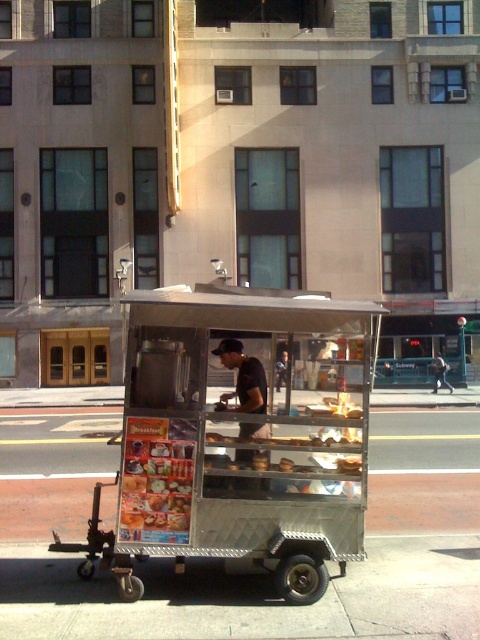
Does brushed metal pavement at lower center appear on the right side of metallic silver cart at center?

No, brushed metal pavement at lower center is not to the right of metallic silver cart at center.

Which of these two, brushed metal pavement at lower center or metallic silver cart at center, stands shorter?

brushed metal pavement at lower center is shorter.

At what (x,y) coordinates should I click in order to perform the action: click on brushed metal pavement at lower center. Please return your answer as a coordinate pair (x, y). Looking at the image, I should click on (251, 596).

In order to click on brushed metal pavement at lower center in this screenshot , I will do `click(251, 596)`.

Is brushed metal pavement at lower center taller than dark blue uniform at center?

Incorrect, brushed metal pavement at lower center's height is not larger of dark blue uniform at center's.

Does point (451, 589) lie in front of point (447, 385)?

Yes, it is in front of point (447, 385).

Is point (376, 588) farther from camera compared to point (436, 381)?

No, (376, 588) is closer to viewer.

Find the location of a particular element. This screenshot has height=640, width=480. brushed metal pavement at lower center is located at coordinates (251, 596).

Which is in front, point (326, 502) or point (470, 624)?

Point (470, 624) is more forward.

The height and width of the screenshot is (640, 480). I want to click on metallic silver food cart at center, so click(240, 438).

You are a GUI agent. You are given a task and a screenshot of the screen. Output one action in this format:
    pyautogui.click(x=<x>, y=<y>)
    Task: Click on the metallic silver food cart at center
    The image size is (480, 640).
    Given the screenshot: What is the action you would take?
    pyautogui.click(x=240, y=438)